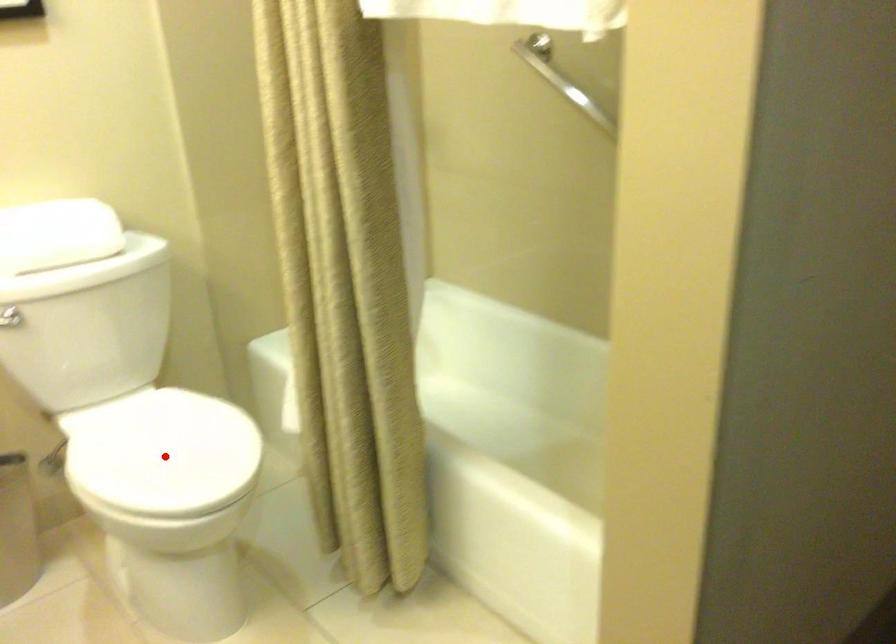
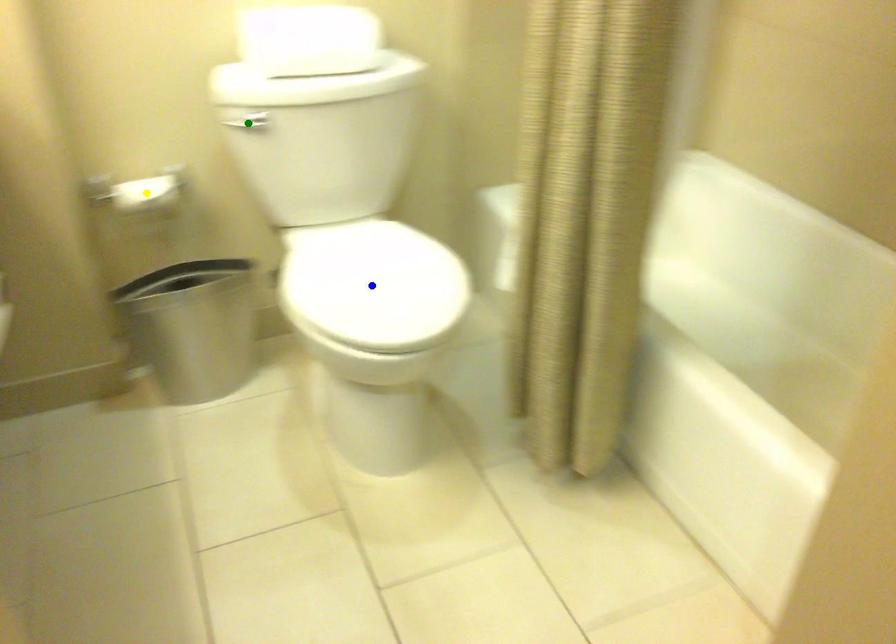
Question: I am providing you with two images of the same scene from different viewpoints. A red point is marked on the first image. You are given multiple points on the second image. Which point in image 2 represents the same 3d spot as the red point in image 1?

Choices:
 (A) blue point
 (B) green point
 (C) yellow point

Answer: (A)